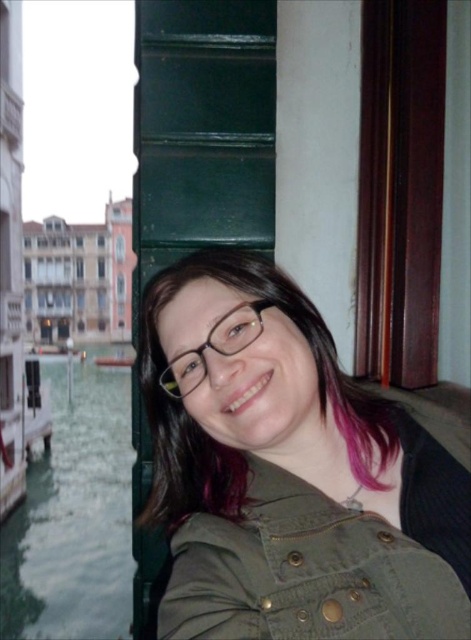
Question: Is green liquid water at lower left smaller than clear plastic glasses at center?

Choices:
 (A) no
 (B) yes

Answer: (A)

Question: Can you confirm if matte olive-green jacket at center is positioned to the left of green liquid water at lower left?

Choices:
 (A) yes
 (B) no

Answer: (B)

Question: Which is farther from the green liquid water at lower left?

Choices:
 (A) clear plastic glasses at center
 (B) matte olive-green jacket at center

Answer: (A)

Question: Which point is farther to the camera?

Choices:
 (A) clear plastic glasses at center
 (B) green liquid water at lower left

Answer: (B)

Question: Is matte olive-green jacket at center closer to camera compared to green liquid water at lower left?

Choices:
 (A) no
 (B) yes

Answer: (B)

Question: Which object appears closest to the camera in this image?

Choices:
 (A) matte olive-green jacket at center
 (B) clear plastic glasses at center

Answer: (A)